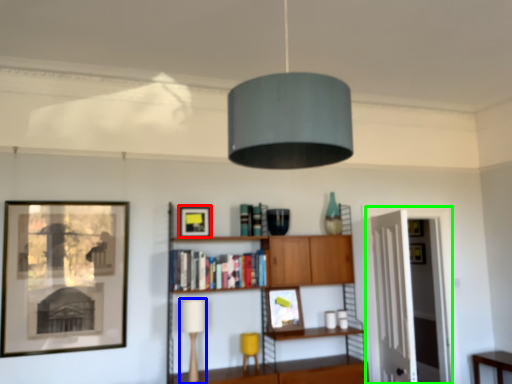
Question: Which object is the closest to the picture frame (highlighted by a red box)? Choose among these: table lamp (highlighted by a blue box) or glass door (highlighted by a green box).

Choices:
 (A) table lamp
 (B) glass door

Answer: (A)